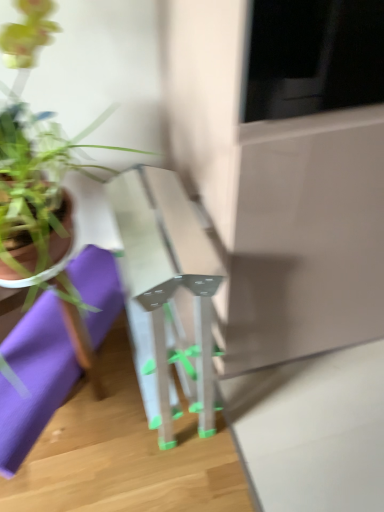
Question: From the image's perspective, is transparent plastic table at center located beneath green matte plant pot at left?

Choices:
 (A) no
 (B) yes

Answer: (B)

Question: Is transparent plastic table at center to the left of green matte plant pot at left from the viewer's perspective?

Choices:
 (A) yes
 (B) no

Answer: (B)

Question: Does transparent plastic table at center come behind green matte plant pot at left?

Choices:
 (A) yes
 (B) no

Answer: (A)

Question: Is transparent plastic table at center next to green matte plant pot at left?

Choices:
 (A) no
 (B) yes

Answer: (A)

Question: From a real-world perspective, is transparent plastic table at center located beneath green matte plant pot at left?

Choices:
 (A) yes
 (B) no

Answer: (A)

Question: Visually, is transparent plastic table at center positioned to the left or to the right of green matte plant pot at left?

Choices:
 (A) left
 (B) right

Answer: (B)

Question: In terms of height, does transparent plastic table at center look taller or shorter compared to green matte plant pot at left?

Choices:
 (A) tall
 (B) short

Answer: (A)

Question: From a real-world perspective, relative to green matte plant pot at left, is transparent plastic table at center vertically above or below?

Choices:
 (A) above
 (B) below

Answer: (B)

Question: From the image's perspective, is transparent plastic table at center positioned above or below green matte plant pot at left?

Choices:
 (A) above
 (B) below

Answer: (B)

Question: Looking at their shapes, would you say purple fabric at lower left is wider or thinner than green matte plant pot at left?

Choices:
 (A) thin
 (B) wide

Answer: (B)

Question: Is purple fabric at lower left in front of or behind green matte plant pot at left in the image?

Choices:
 (A) behind
 (B) front

Answer: (A)

Question: Considering the positions of purple fabric at lower left and green matte plant pot at left in the image, is purple fabric at lower left bigger or smaller than green matte plant pot at left?

Choices:
 (A) big
 (B) small

Answer: (B)

Question: In terms of height, does purple fabric at lower left look taller or shorter compared to green matte plant pot at left?

Choices:
 (A) short
 (B) tall

Answer: (A)

Question: Does point (4, 411) appear closer or farther from the camera than point (167, 409)?

Choices:
 (A) farther
 (B) closer

Answer: (B)

Question: Based on their sizes in the image, would you say purple fabric at lower left is bigger or smaller than transparent plastic table at center?

Choices:
 (A) big
 (B) small

Answer: (B)